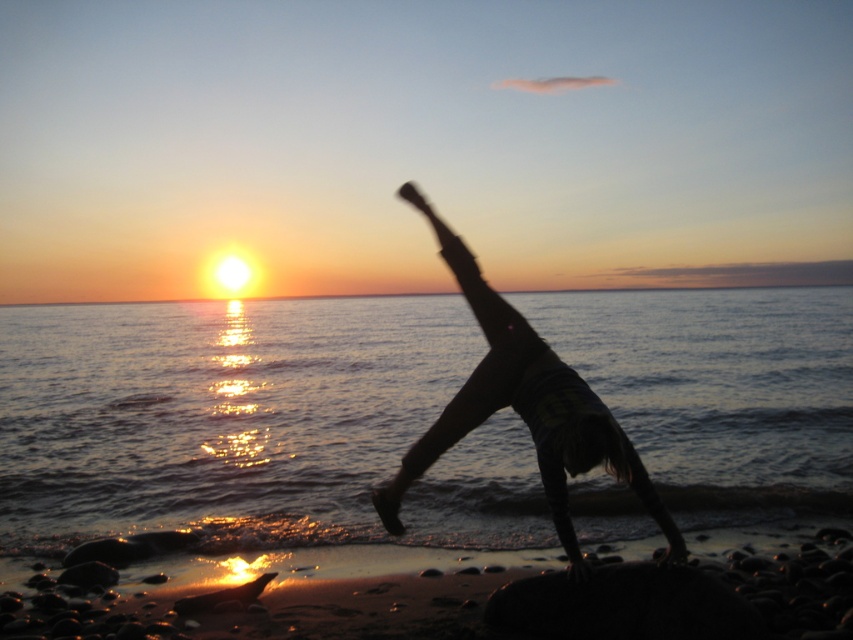
Is glistening water at sunset right below silhouette figure at center?

No, glistening water at sunset right is not below silhouette figure at center.

Which is more to the left, glistening water at sunset right or silhouette figure at center?

Positioned to the left is silhouette figure at center.

The height and width of the screenshot is (640, 853). I want to click on glistening water at sunset right, so click(x=218, y=416).